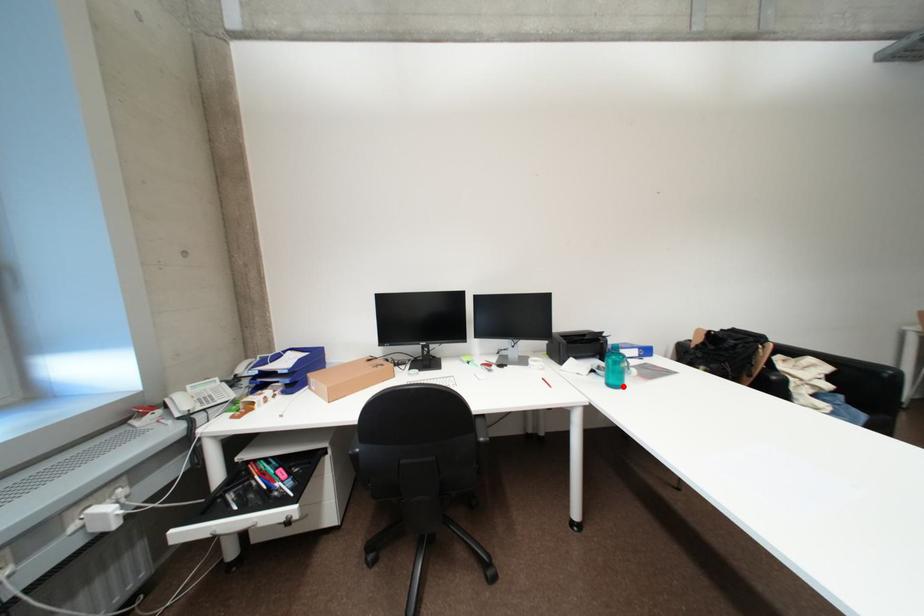
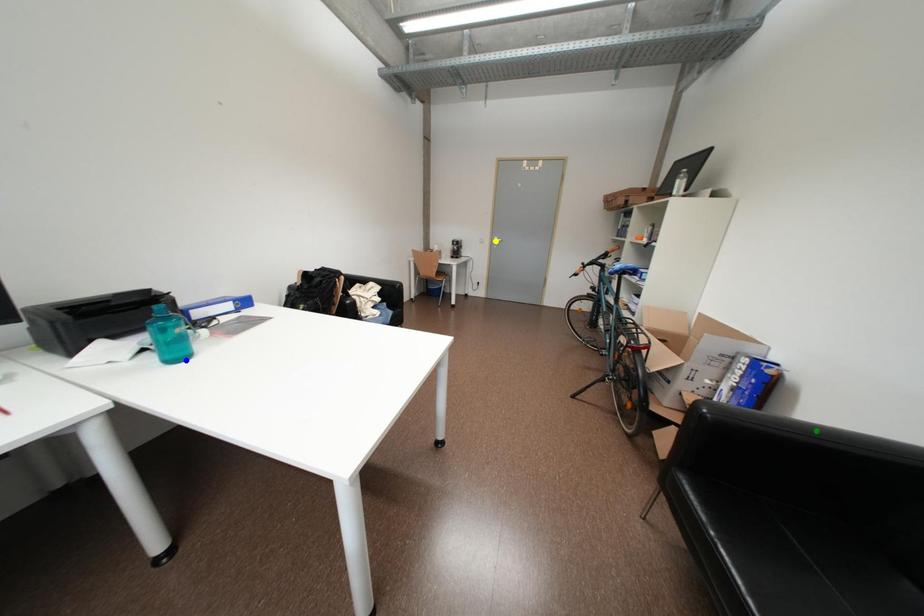
Question: I am providing you with two images of the same scene from different viewpoints. A red point is marked on the first image. You are given multiple points on the second image. In image 2, which mark is for the same physical point as the one in image 1?

Choices:
 (A) yellow point
 (B) green point
 (C) blue point

Answer: (C)